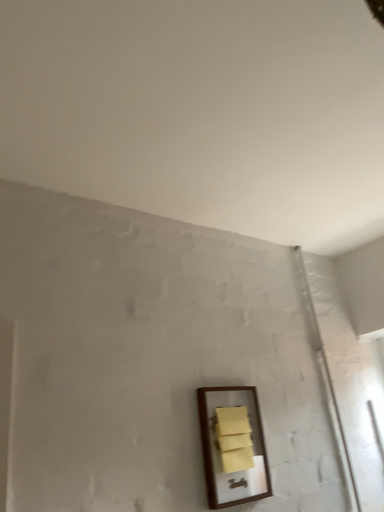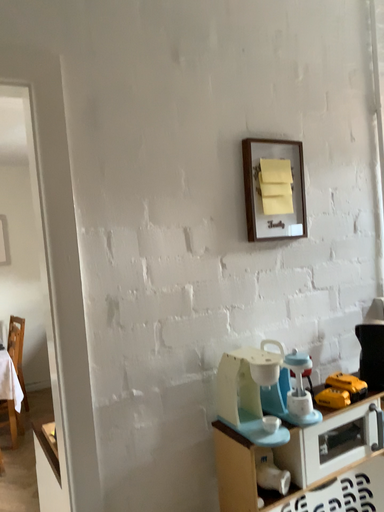
Question: Which way did the camera rotate in the video?

Choices:
 (A) rotated left
 (B) rotated right

Answer: (A)